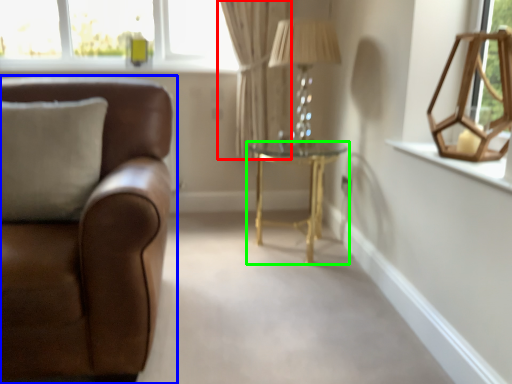
Question: Considering the real-world distances, which object is closest to curtain (highlighted by a red box)? studio couch (highlighted by a blue box) or table (highlighted by a green box).

Choices:
 (A) studio couch
 (B) table

Answer: (B)